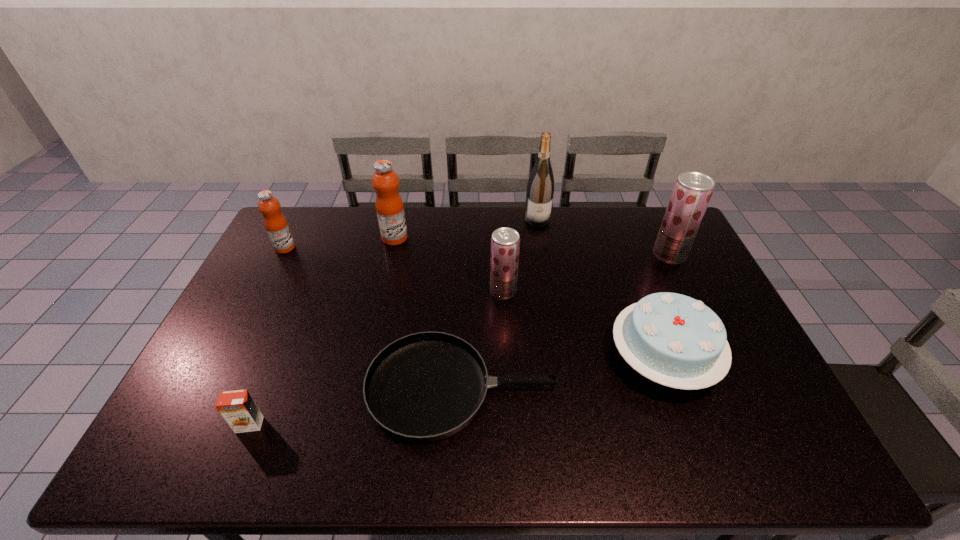
Locate an element on the screen. vacant area in the image that satisfies the following two spatial constraints: 1. on the front label of the right orange fruit juice; 2. on the right side of the third shortest object is located at coordinates (367, 359).

At what (x,y) coordinates should I click in order to perform the action: click on free region that satisfies the following two spatial constraints: 1. on the front label of the bigger strawberry fruit juice; 2. on the left side of the leftmost object. Please return your answer as a coordinate pair (x, y). The width and height of the screenshot is (960, 540). Looking at the image, I should click on (281, 255).

You are a GUI agent. You are given a task and a screenshot of the screen. Output one action in this format:
    pyautogui.click(x=<x>, y=<y>)
    Task: Click on the free spot that satisfies the following two spatial constraints: 1. on the front label of the right orange fruit juice; 2. on the right side of the third shortest object
    The width and height of the screenshot is (960, 540).
    Given the screenshot: What is the action you would take?
    pyautogui.click(x=367, y=359)

At what (x,y) coordinates should I click in order to perform the action: click on free space that satisfies the following two spatial constraints: 1. on the label of the farthest object; 2. on the right side of the birthday cake. Please return your answer as a coordinate pair (x, y). The height and width of the screenshot is (540, 960). Looking at the image, I should click on (560, 359).

You are a GUI agent. You are given a task and a screenshot of the screen. Output one action in this format:
    pyautogui.click(x=<x>, y=<y>)
    Task: Click on the vacant space that satisfies the following two spatial constraints: 1. on the front label of the left orange fruit juice; 2. on the left side of the birthday cake
    The image size is (960, 540).
    Given the screenshot: What is the action you would take?
    tap(228, 359)